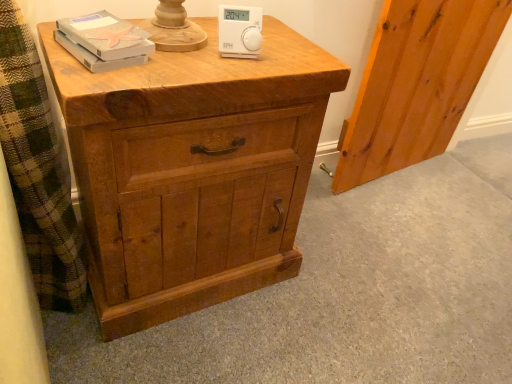
Question: Should I look upward or downward to see natural wood screen door at right?

Choices:
 (A) down
 (B) up

Answer: (B)

Question: Is the position of natural wood screen door at right more distant than that of matte gray book at upper left?

Choices:
 (A) yes
 (B) no

Answer: (A)

Question: Is matte gray book at upper left a part of natural wood screen door at right?

Choices:
 (A) no
 (B) yes

Answer: (A)

Question: Is natural wood screen door at right oriented towards matte gray book at upper left?

Choices:
 (A) yes
 (B) no

Answer: (B)

Question: From the image's perspective, is natural wood screen door at right on matte gray book at upper left?

Choices:
 (A) yes
 (B) no

Answer: (A)

Question: From a real-world perspective, is natural wood screen door at right beneath matte gray book at upper left?

Choices:
 (A) yes
 (B) no

Answer: (A)

Question: Is natural wood screen door at right located outside matte gray book at upper left?

Choices:
 (A) no
 (B) yes

Answer: (B)

Question: Is white plastic thermostat at upper center at the right side of natural wood chest of drawers at center?

Choices:
 (A) no
 (B) yes

Answer: (B)

Question: Can you confirm if white plastic thermostat at upper center is taller than natural wood chest of drawers at center?

Choices:
 (A) yes
 (B) no

Answer: (B)

Question: From a real-world perspective, is white plastic thermostat at upper center under natural wood chest of drawers at center?

Choices:
 (A) no
 (B) yes

Answer: (A)

Question: Does white plastic thermostat at upper center have a smaller size compared to natural wood chest of drawers at center?

Choices:
 (A) yes
 (B) no

Answer: (A)

Question: Is the position of white plastic thermostat at upper center more distant than that of natural wood chest of drawers at center?

Choices:
 (A) no
 (B) yes

Answer: (B)

Question: Does white plastic thermostat at upper center come in front of natural wood chest of drawers at center?

Choices:
 (A) yes
 (B) no

Answer: (B)

Question: Is matte gray book at upper left further to the viewer compared to white plastic thermostat at upper center?

Choices:
 (A) no
 (B) yes

Answer: (A)